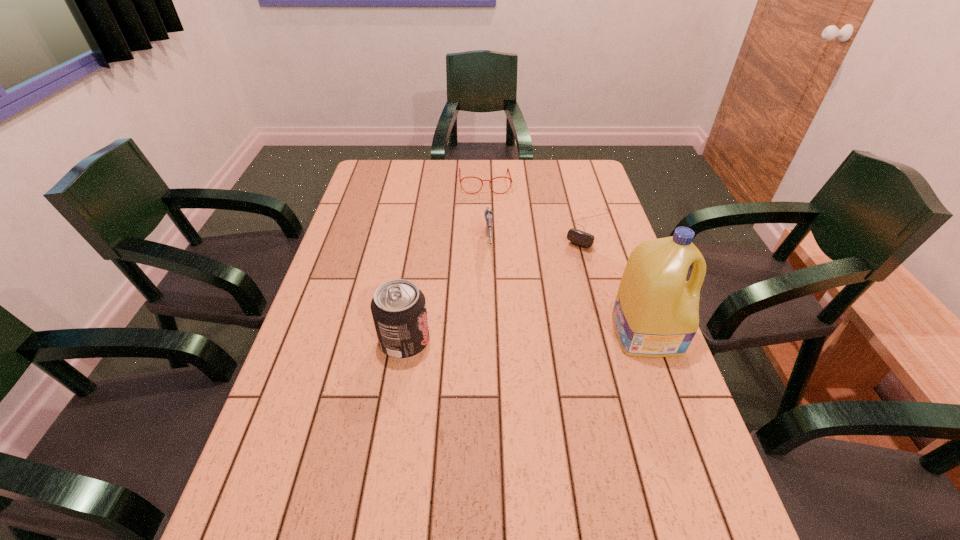
Identify the location of vacant region located on the front-facing side of the shortest object. This screenshot has height=540, width=960. (527, 322).

Find the location of `vacant space positioned 0.110m on the face of the second shortest object`. vacant space positioned 0.110m on the face of the second shortest object is located at coordinates (487, 212).

Find the location of a particular element. This screenshot has width=960, height=540. free region located on the face of the second shortest object is located at coordinates (489, 253).

Where is `vacant space located 0.050m on the face of the second shortest object`? vacant space located 0.050m on the face of the second shortest object is located at coordinates (486, 202).

Find the location of a particular element. vacant space located at the barrel of the third shortest object is located at coordinates (492, 308).

The width and height of the screenshot is (960, 540). I want to click on vacant space located 0.320m at the barrel of the third shortest object, so click(494, 364).

Locate an element on the screen. vacant area situated at the barrel of the third shortest object is located at coordinates (495, 386).

Image resolution: width=960 pixels, height=540 pixels. Identify the location of object that is at the far edge. (460, 180).

The width and height of the screenshot is (960, 540). Find the location of `detergent that is at the right edge`. detergent that is at the right edge is located at coordinates (656, 313).

Image resolution: width=960 pixels, height=540 pixels. I want to click on webcam that is at the right edge, so click(581, 238).